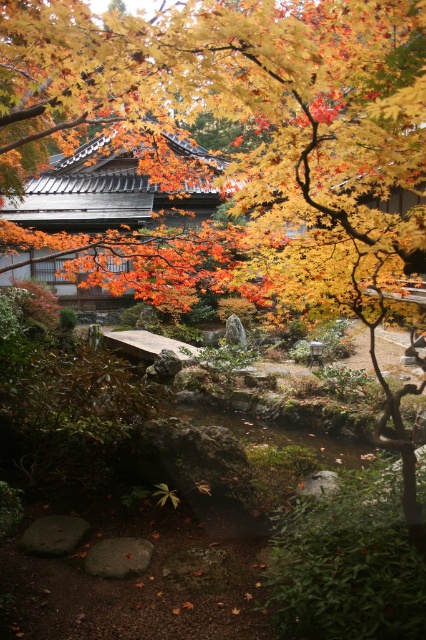
Question: Considering the relative positions of golden textured leaves at upper center and smooth stone bridge at center in the image provided, where is golden textured leaves at upper center located with respect to smooth stone bridge at center?

Choices:
 (A) below
 (B) above

Answer: (B)

Question: Which object is farther from the camera taking this photo?

Choices:
 (A) smooth stone bridge at center
 (B) golden textured leaves at upper center

Answer: (A)

Question: Can you confirm if golden textured leaves at upper center is positioned below smooth stone bridge at center?

Choices:
 (A) no
 (B) yes

Answer: (A)

Question: Does golden textured leaves at upper center have a greater width compared to smooth stone bridge at center?

Choices:
 (A) yes
 (B) no

Answer: (A)